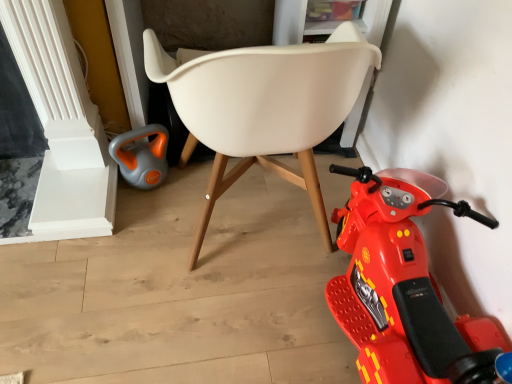
Question: Is white plastic chair at center at the left side of shiny plastic scooter at lower right?

Choices:
 (A) no
 (B) yes

Answer: (B)

Question: Can you confirm if white plastic chair at center is thinner than shiny plastic scooter at lower right?

Choices:
 (A) no
 (B) yes

Answer: (A)

Question: From a real-world perspective, is white plastic chair at center positioned over shiny plastic scooter at lower right based on gravity?

Choices:
 (A) no
 (B) yes

Answer: (B)

Question: Is white plastic chair at center aimed at shiny plastic scooter at lower right?

Choices:
 (A) yes
 (B) no

Answer: (B)

Question: Is white plastic chair at center surrounding shiny plastic scooter at lower right?

Choices:
 (A) no
 (B) yes

Answer: (A)

Question: Considering the positions of point (260, 69) and point (440, 307), is point (260, 69) closer or farther from the camera than point (440, 307)?

Choices:
 (A) closer
 (B) farther

Answer: (A)

Question: Is white plastic chair at center taller or shorter than shiny plastic scooter at lower right?

Choices:
 (A) tall
 (B) short

Answer: (A)

Question: Looking at their shapes, would you say white plastic chair at center is wider or thinner than shiny plastic scooter at lower right?

Choices:
 (A) wide
 (B) thin

Answer: (A)

Question: From the image's perspective, is white plastic chair at center positioned above or below shiny plastic scooter at lower right?

Choices:
 (A) above
 (B) below

Answer: (A)

Question: In terms of width, does gray-orange plastic kettle at lower left look wider or thinner when compared to shiny plastic scooter at lower right?

Choices:
 (A) thin
 (B) wide

Answer: (A)

Question: Is gray-orange plastic kettle at lower left to the left or to the right of shiny plastic scooter at lower right in the image?

Choices:
 (A) right
 (B) left

Answer: (B)

Question: Considering the positions of gray-orange plastic kettle at lower left and shiny plastic scooter at lower right in the image, is gray-orange plastic kettle at lower left taller or shorter than shiny plastic scooter at lower right?

Choices:
 (A) short
 (B) tall

Answer: (A)

Question: From a real-world perspective, relative to shiny plastic scooter at lower right, is gray-orange plastic kettle at lower left vertically above or below?

Choices:
 (A) below
 (B) above

Answer: (A)

Question: Based on their positions, is shiny plastic scooter at lower right located to the left or right of gray-orange plastic kettle at lower left?

Choices:
 (A) left
 (B) right

Answer: (B)

Question: Is point (330, 168) closer or farther from the camera than point (155, 168)?

Choices:
 (A) farther
 (B) closer

Answer: (A)